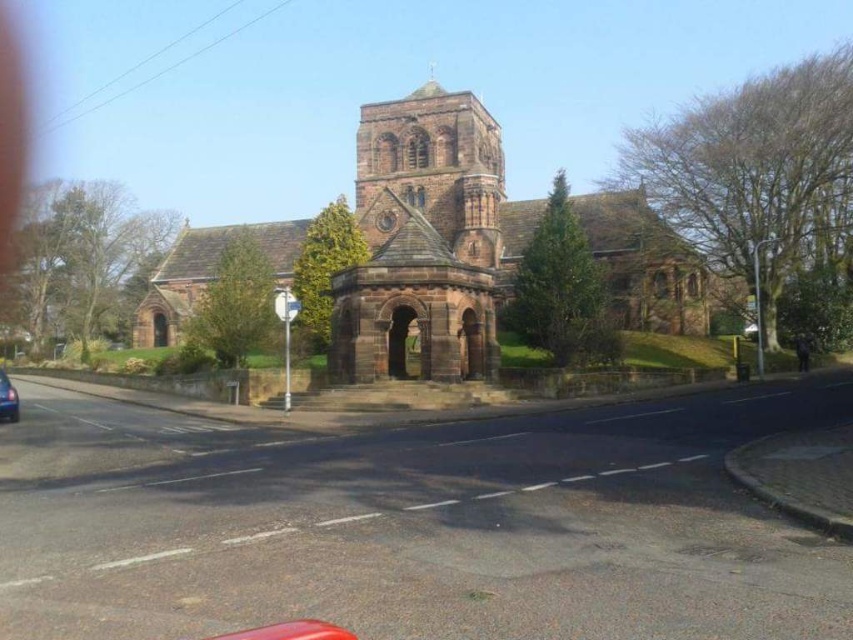
Question: Does brown stone tower at center appear over metallic silver car at lower left?

Choices:
 (A) no
 (B) yes

Answer: (B)

Question: Does metallic silver car at lower left have a lesser width compared to metallic silver car at center?

Choices:
 (A) no
 (B) yes

Answer: (B)

Question: Does metallic silver car at lower left appear on the left side of metallic silver car at center?

Choices:
 (A) no
 (B) yes

Answer: (B)

Question: Which point is closer to the camera taking this photo?

Choices:
 (A) (746, 330)
 (B) (376, 198)
 (C) (399, 214)
 (D) (7, 404)

Answer: (D)

Question: Which of these objects is positioned closest to the metallic silver car at lower left?

Choices:
 (A) brown stone tower at center
 (B) brown stone church at center
 (C) metallic silver car at center

Answer: (A)

Question: Which point is farther from the camera taking this photo?

Choices:
 (A) (376, 252)
 (B) (10, 406)

Answer: (A)